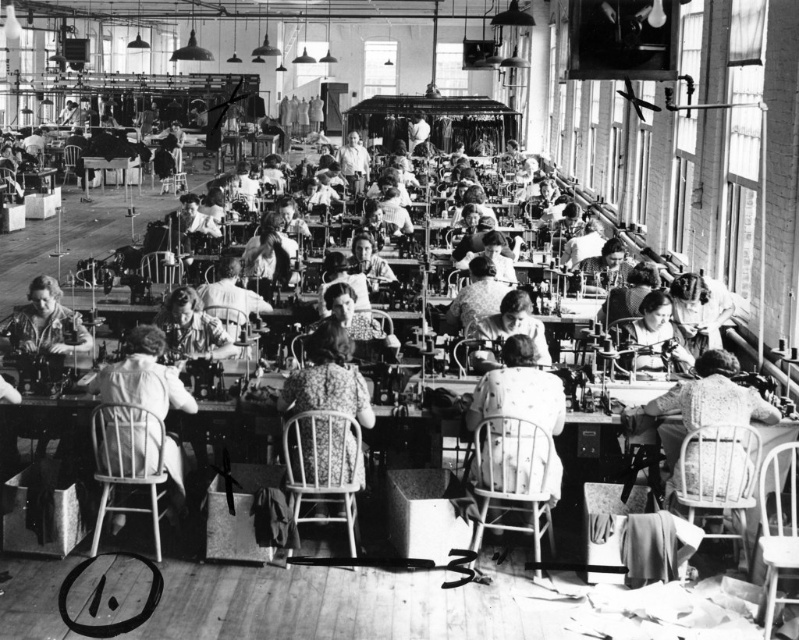
Is wooden table at center below floral fabric dress at center?

Yes, wooden table at center is below floral fabric dress at center.

Based on the photo, is wooden table at center to the right of floral fabric dress at center from the viewer's perspective?

No, wooden table at center is not to the right of floral fabric dress at center.

Is point (2, 504) closer to camera compared to point (287, 403)?

Yes, point (2, 504) is in front of point (287, 403).

In order to click on wooden table at center in this screenshot , I will do `click(54, 417)`.